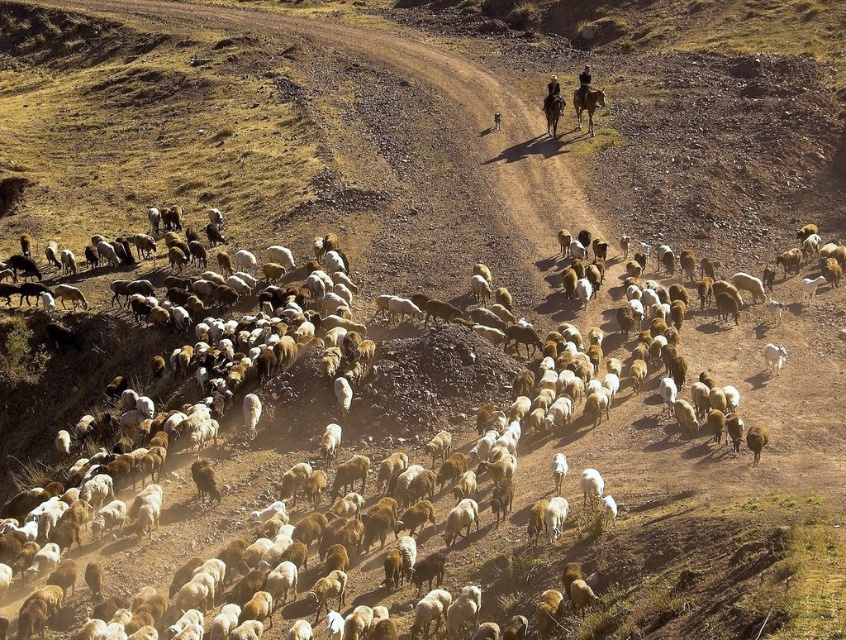
You are a shepherd guiding your flock through the mountainous terrain. You notice the white woolly sheep at center and the brown glossy horse at upper center. Which animal is positioned higher up in the image?

The brown glossy horse at upper center is positioned higher up in the image than the white woolly sheep at center.

You are a shepherd guiding the flock along the winding dirt road in the mountainous terrain. You notice two markers on the path ahead at coordinates point (x=608, y=472) and point (x=575, y=106). Which marker is closer to your current position?

Point (x=608, y=472) is in front of point (x=575, y=106), so the marker at point (x=608, y=472) is closer to your current position.

You are a drone operator trying to capture an aerial shot of the scene. The drone has a camera with a field of view that covers a square area of 0.2 units on each side. If the drone is positioned directly above the brown glossy horse at upper center, will the entire flock of sheep be visible in the camera frame?

The brown glossy horse at upper center is located at point (586,104). The camera frame covers a square area of 0.2 units on each side, so the frame extends from 0.064 to 0.264 on the x and y axes. Since the flock of sheep is densely packed along the winding dirt road and the horse is at the upper center, the sheep are likely positioned further down the road outside the camera frame. Therefore, the entire flock of sheep will not be visible in the camera frame.